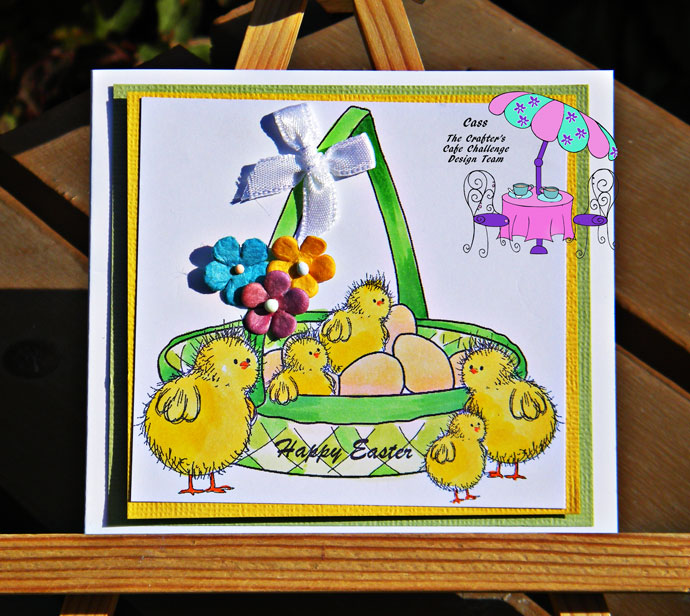
The width and height of the screenshot is (690, 616). Identify the location of pink table cloth. (529, 223).